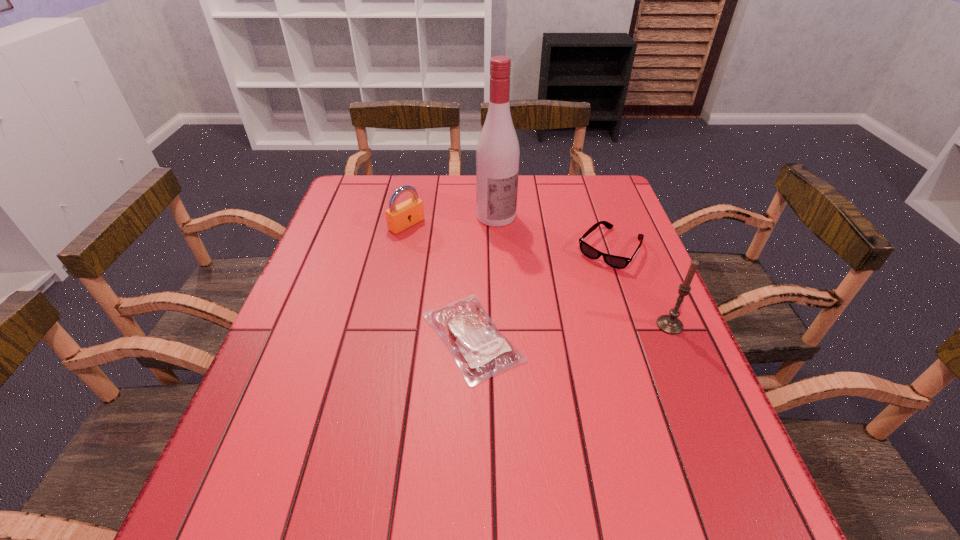
Locate an element on the screen. The height and width of the screenshot is (540, 960). free spot on the desktop that is between the shortest object and the fourth shortest object and is positioned on the front-facing side of the sunglasses is located at coordinates (543, 333).

Image resolution: width=960 pixels, height=540 pixels. I want to click on free spot on the desktop that is between the steak and the candle and is positioned to unlock the third shortest object from the front, so click(x=569, y=331).

The width and height of the screenshot is (960, 540). Identify the location of free spot on the desktop that is between the shortest object and the candle and is positioned on the label of the tallest object. point(595,329).